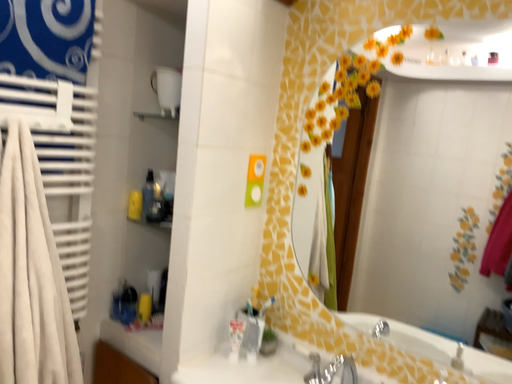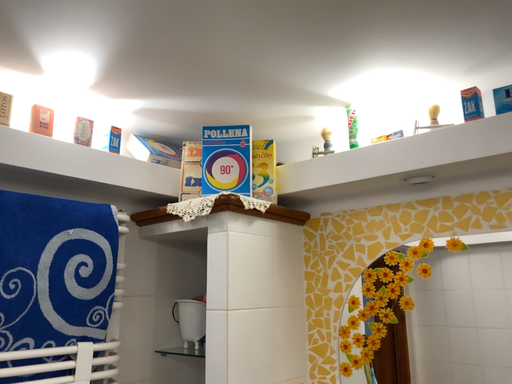
Question: Which way did the camera rotate in the video?

Choices:
 (A) rotated upward
 (B) rotated downward

Answer: (A)